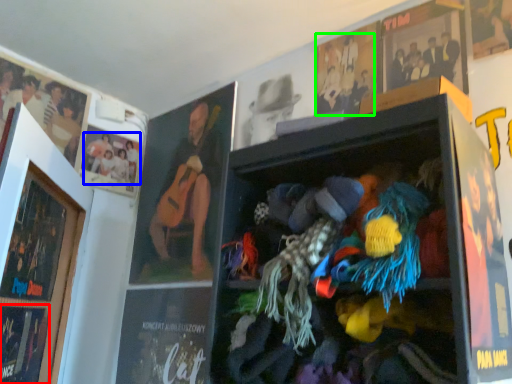
Question: Based on their relative distances, which object is nearer to magazine (highlighted by a red box)? Choose from person (highlighted by a blue box) and person (highlighted by a green box).

Choices:
 (A) person
 (B) person

Answer: (A)